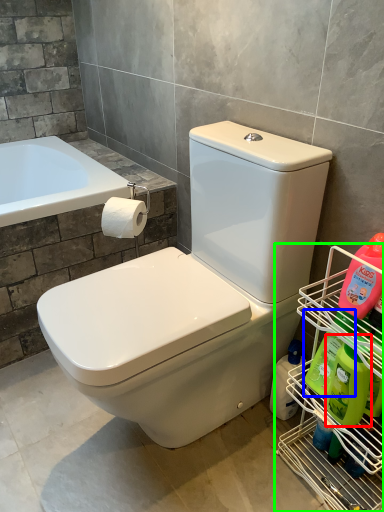
Question: Which object is the farthest from cleaning product (highlighted by a red box)? Choose among these: cleaning product (highlighted by a blue box) or shelf (highlighted by a green box).

Choices:
 (A) cleaning product
 (B) shelf

Answer: (B)